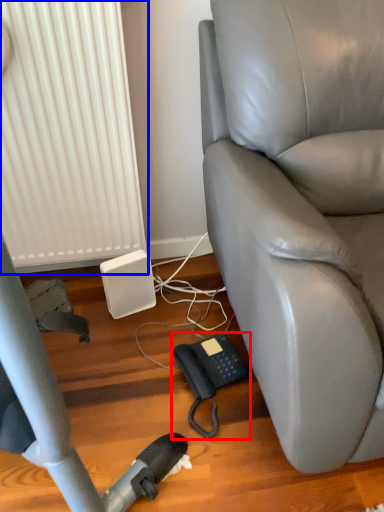
Question: Which point is further to the camera, corded phone (highlighted by a red box) or radiator (highlighted by a blue box)?

Choices:
 (A) corded phone
 (B) radiator

Answer: (A)